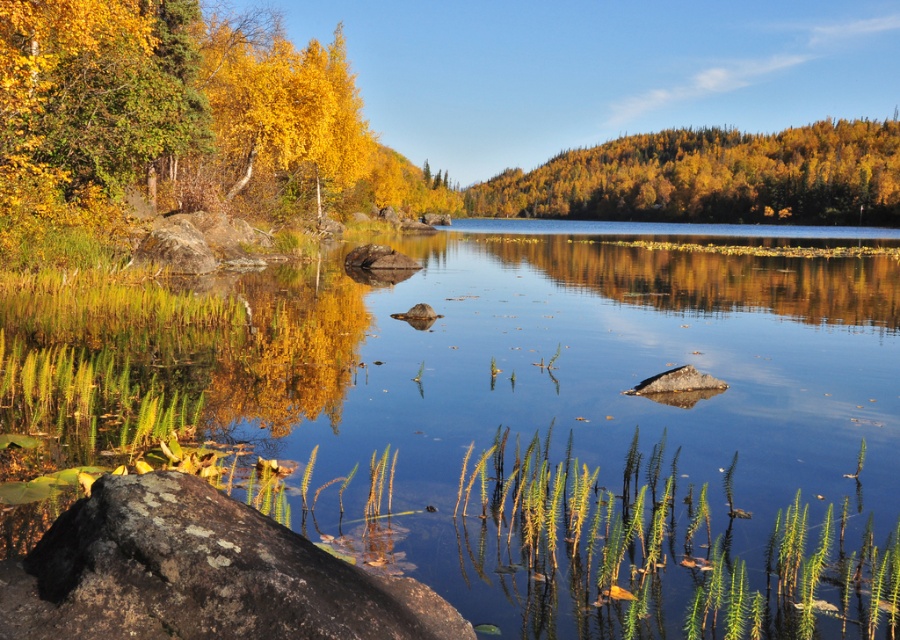
You are standing at the center of the image and want to move towards the rusty stone at lower left. Which direction should you move?

Since the rusty stone at lower left is located at point 0.898 on the x axis and 0.223 on the y axis, you should move to the left and downward to reach it.

You are a photographer planning to capture the clear water at center and the rusty stone at lower left in a single frame. Based on their sizes in the image, which object will occupy more of the frame?

The clear water at center is bigger than the rusty stone at lower left, so it will occupy more of the frame.